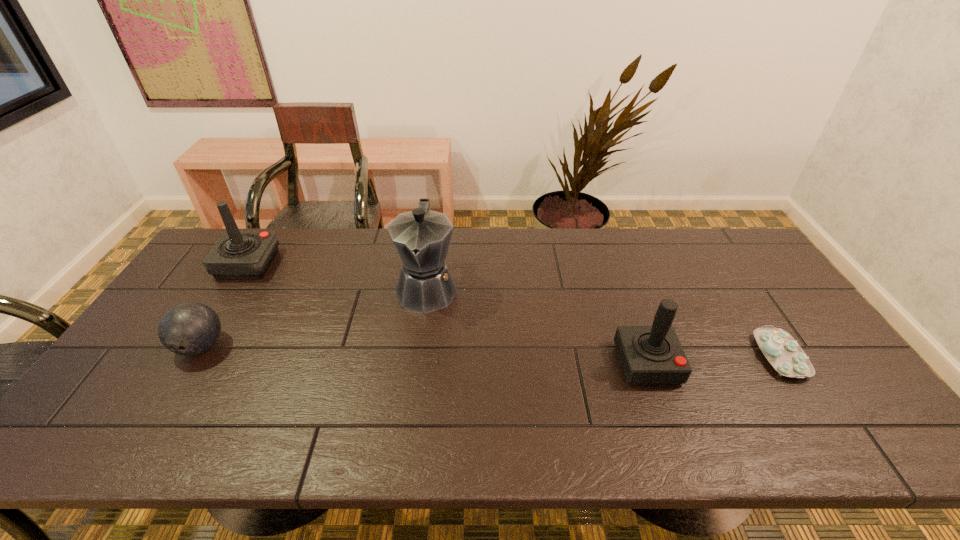
Where is `coffeepot`? coffeepot is located at coordinates (x=422, y=237).

Find the location of a particular element. The width and height of the screenshot is (960, 540). the tallest object is located at coordinates (422, 237).

Locate an element on the screen. the farther joystick is located at coordinates (238, 254).

At what (x,y) coordinates should I click in order to perform the action: click on the second object from right to left. Please return your answer as a coordinate pair (x, y). The image size is (960, 540). Looking at the image, I should click on pyautogui.click(x=653, y=354).

The image size is (960, 540). I want to click on the right joystick, so click(x=653, y=354).

Where is `bowling ball`? This screenshot has height=540, width=960. bowling ball is located at coordinates (187, 329).

Find the location of `the shortest object`. the shortest object is located at coordinates pos(786,356).

In order to click on the rightmost object in this screenshot , I will do `click(786, 356)`.

Identify the location of free spot located at the spout of the third object from left to right. (414, 387).

Identify the location of vacant space located on the front-facing side of the left joystick. This screenshot has height=540, width=960. (296, 264).